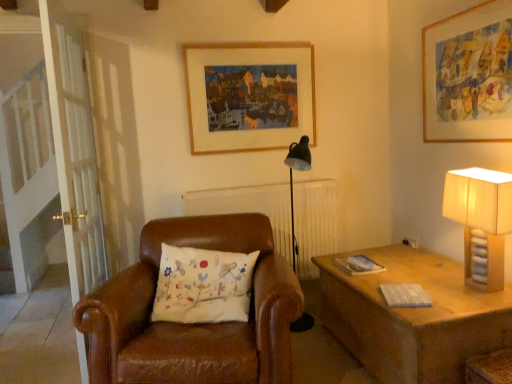
Question: Is beige fabric lampshade at right far away from white embroidered pillow at center?

Choices:
 (A) yes
 (B) no

Answer: (A)

Question: Is beige fabric lampshade at right outside of white embroidered pillow at center?

Choices:
 (A) no
 (B) yes

Answer: (B)

Question: From a real-world perspective, is beige fabric lampshade at right beneath white embroidered pillow at center?

Choices:
 (A) yes
 (B) no

Answer: (B)

Question: Is beige fabric lampshade at right behind white embroidered pillow at center?

Choices:
 (A) no
 (B) yes

Answer: (A)

Question: From a real-world perspective, is beige fabric lampshade at right over white embroidered pillow at center?

Choices:
 (A) no
 (B) yes

Answer: (B)

Question: Would you say beige fabric lampshade at right is to the left or to the right of white embroidered pillow at center in the picture?

Choices:
 (A) left
 (B) right

Answer: (B)

Question: In terms of size, does beige fabric lampshade at right appear bigger or smaller than white embroidered pillow at center?

Choices:
 (A) small
 (B) big

Answer: (A)

Question: From a real-world perspective, is beige fabric lampshade at right positioned above or below white embroidered pillow at center?

Choices:
 (A) below
 (B) above

Answer: (B)

Question: From the image's perspective, is beige fabric lampshade at right above or below white embroidered pillow at center?

Choices:
 (A) below
 (B) above

Answer: (B)

Question: Considering the positions of point (89, 220) and point (271, 145), is point (89, 220) closer or farther from the camera than point (271, 145)?

Choices:
 (A) farther
 (B) closer

Answer: (B)

Question: From the image's perspective, is white wooden screen door at left positioned above or below wooden picture frame at upper center, the 1th picture frame from the back?

Choices:
 (A) below
 (B) above

Answer: (A)

Question: From a real-world perspective, is white wooden screen door at left above or below wooden picture frame at upper center, the 2th picture frame when ordered from front to back?

Choices:
 (A) above
 (B) below

Answer: (B)

Question: Looking at their shapes, would you say white wooden screen door at left is wider or thinner than wooden picture frame at upper center, the 1th picture frame from the back?

Choices:
 (A) wide
 (B) thin

Answer: (A)

Question: Would you say white wooden screen door at left is to the left or to the right of beige fabric lampshade at right in the picture?

Choices:
 (A) left
 (B) right

Answer: (A)

Question: Considering the positions of point (74, 225) and point (503, 233), is point (74, 225) closer or farther from the camera than point (503, 233)?

Choices:
 (A) farther
 (B) closer

Answer: (A)